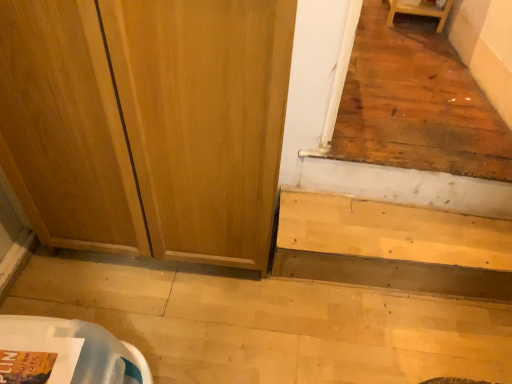
Question: In the image, is wooden screen door at center on the left side or the right side of light wood/stained stairs at lower right?

Choices:
 (A) right
 (B) left

Answer: (B)

Question: Is point (266, 193) closer or farther from the camera than point (364, 261)?

Choices:
 (A) closer
 (B) farther

Answer: (A)

Question: Considering the positions of wooden screen door at center and light wood/stained stairs at lower right in the image, is wooden screen door at center bigger or smaller than light wood/stained stairs at lower right?

Choices:
 (A) big
 (B) small

Answer: (A)

Question: Do you think light wood/stained stairs at lower right is within wooden screen door at center, or outside of it?

Choices:
 (A) outside
 (B) inside

Answer: (A)

Question: From a real-world perspective, is light wood/stained stairs at lower right physically located above or below wooden screen door at center?

Choices:
 (A) below
 (B) above

Answer: (A)

Question: Is point (422, 264) closer or farther from the camera than point (285, 8)?

Choices:
 (A) closer
 (B) farther

Answer: (B)

Question: From the image's perspective, is light wood/stained stairs at lower right located above or below wooden screen door at center?

Choices:
 (A) below
 (B) above

Answer: (A)